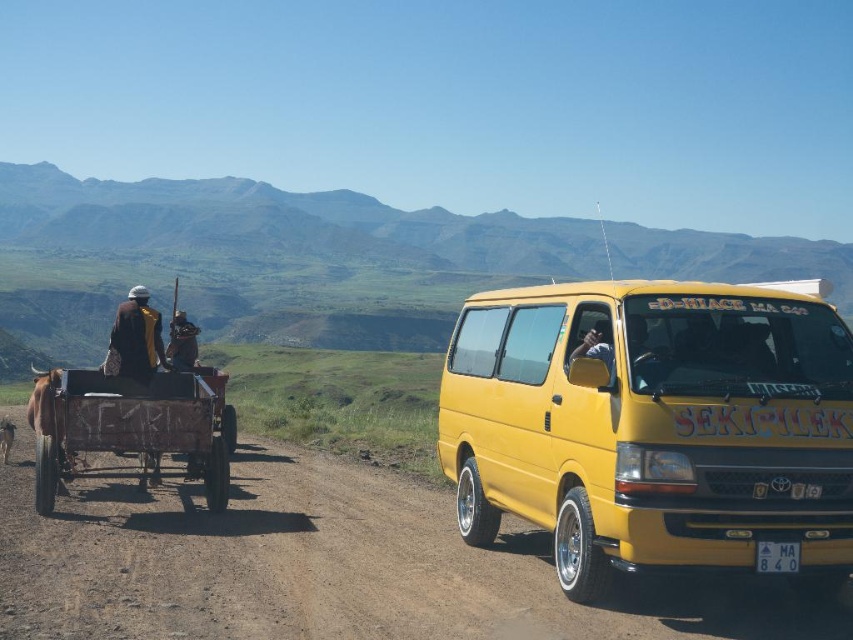
From the picture: Between yellow fabric jacket at left and matte black shirt at center, which one is positioned higher?

yellow fabric jacket at left is above.

Does yellow fabric jacket at left appear on the left side of matte black shirt at center?

Correct, you'll find yellow fabric jacket at left to the left of matte black shirt at center.

Who is more forward, (x=134, y=346) or (x=608, y=356)?

Positioned in front is point (x=608, y=356).

The image size is (853, 640). I want to click on yellow fabric jacket at left, so click(x=137, y=337).

Which is more to the right, brown leather jacket at left or matte black shirt at center?

From the viewer's perspective, matte black shirt at center appears more on the right side.

Is point (172, 330) in front of point (584, 348)?

That is False.

Is point (196, 340) closer to camera compared to point (596, 342)?

No, (196, 340) is behind (596, 342).

I want to click on brown leather jacket at left, so click(181, 342).

Between brown dirt track at center and brown wooden wagon at left, which one has more height?

brown wooden wagon at left

Who is positioned more to the left, brown dirt track at center or brown wooden wagon at left?

From the viewer's perspective, brown wooden wagon at left appears more on the left side.

This screenshot has height=640, width=853. I want to click on brown dirt track at center, so click(x=328, y=566).

At what (x,y) coordinates should I click in order to perform the action: click on brown dirt track at center. Please return your answer as a coordinate pair (x, y). Looking at the image, I should click on (328, 566).